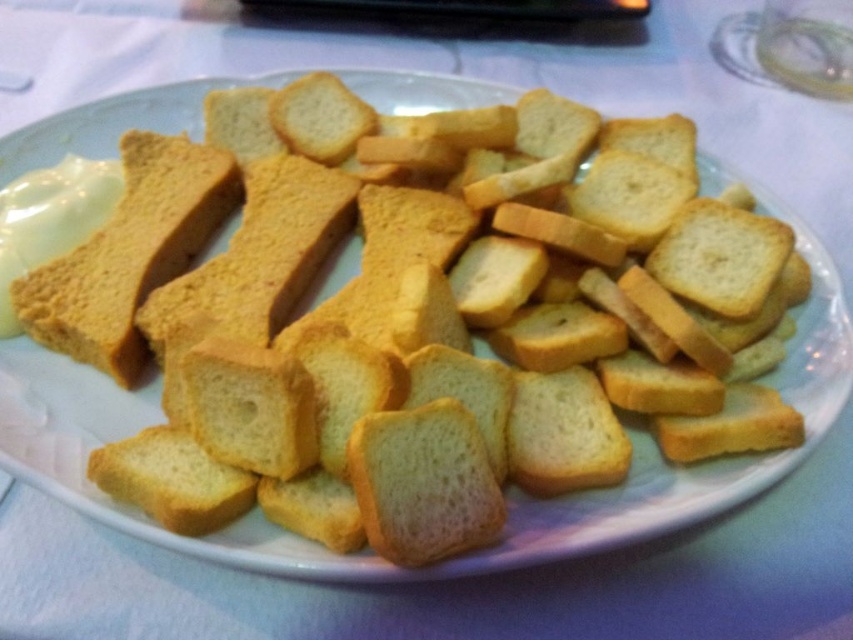
Question: Is yellow crumbly bread at upper left in front of golden crispy crouton at center?

Choices:
 (A) no
 (B) yes

Answer: (A)

Question: Among these objects, which one is farthest from the camera?

Choices:
 (A) yellow crumbly bread at upper left
 (B) golden crispy crouton at center

Answer: (A)

Question: Considering the relative positions of yellow crumbly bread at upper left and golden crispy crouton at center in the image provided, where is yellow crumbly bread at upper left located with respect to golden crispy crouton at center?

Choices:
 (A) below
 (B) above

Answer: (B)

Question: Is yellow crumbly bread at upper left to the right of golden crispy crouton at center from the viewer's perspective?

Choices:
 (A) yes
 (B) no

Answer: (B)